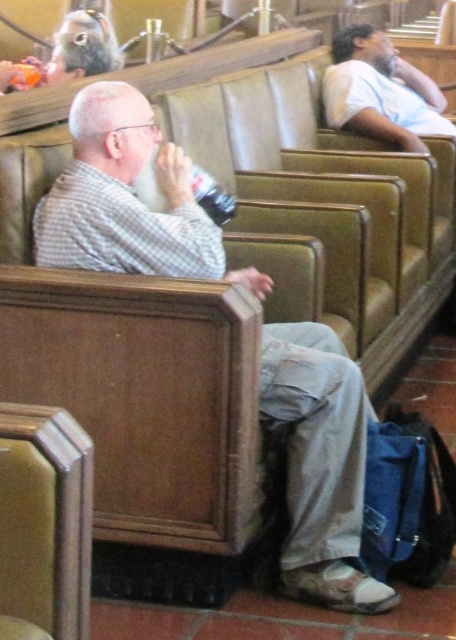
You are an interior designer assessing the courtroom layout. You notice the light brown leather shirt at upper right and the matte black hair at upper left. Which object occupies more visual space in the image?

The light brown leather shirt at upper right occupies more visual space than the matte black hair at upper left as it is larger in size.

You are an observer in the courtroom scene. You notice two features in the image labeled as the light brown leather shirt at upper right and the matte black hair at upper left. Which of these two items is located to the right side of the other?

The light brown leather shirt at upper right is positioned on the right side of matte black hair at upper left.